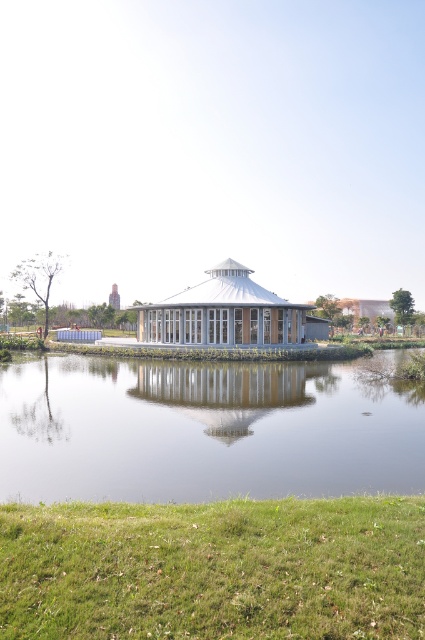
Question: Based on their relative distances, which object is farther from the white glass gazebo at center?

Choices:
 (A) transparent glass pond at center
 (B) green grass at lower center

Answer: (B)

Question: Is green grass at lower center bigger than white glass gazebo at center?

Choices:
 (A) no
 (B) yes

Answer: (A)

Question: In this image, where is green grass at lower center located relative to transparent glass pond at center?

Choices:
 (A) below
 (B) above

Answer: (B)

Question: Estimate the real-world distances between objects in this image. Which object is farther from the transparent glass pond at center?

Choices:
 (A) white glass gazebo at center
 (B) green grass at lower center

Answer: (B)

Question: Considering the real-world distances, which object is closest to the transparent glass pond at center?

Choices:
 (A) white glass gazebo at center
 (B) green grass at lower center

Answer: (A)

Question: Is transparent glass pond at center positioned in front of white glass gazebo at center?

Choices:
 (A) no
 (B) yes

Answer: (B)